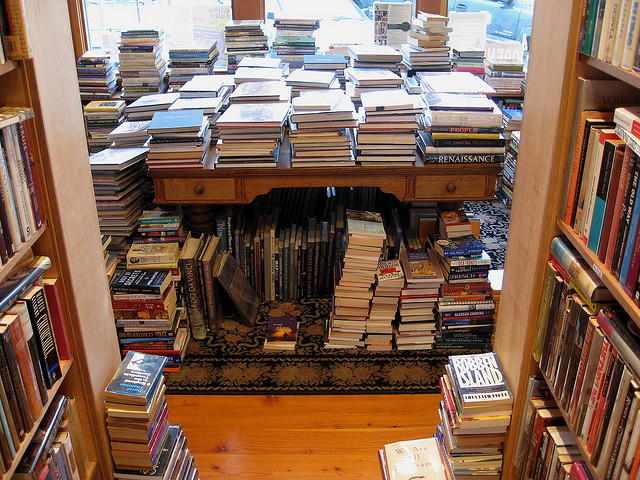
Find the location of a particular element. shelves is located at coordinates (585, 382).